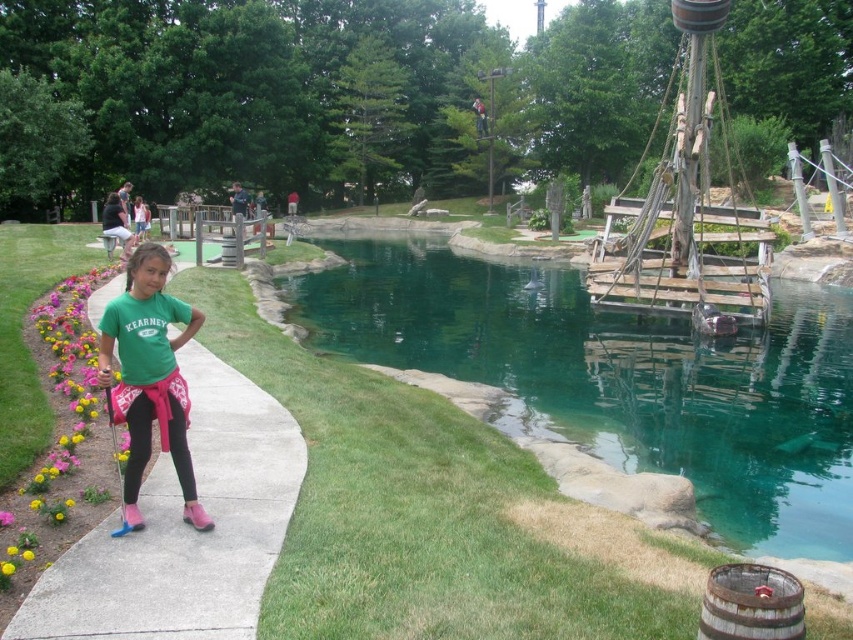
Based on the photo, is concrete sidewalk at center left shorter than green matte shirt at center?

No.

Is point (264, 396) in front of point (120, 348)?

That is False.

At what (x,y) coordinates should I click in order to perform the action: click on concrete sidewalk at center left. Please return your answer as a coordinate pair (x, y). The height and width of the screenshot is (640, 853). Looking at the image, I should click on (184, 529).

Looking at this image, does teal glassy water at center have a larger size compared to green matte shirt at center?

Indeed, teal glassy water at center has a larger size compared to green matte shirt at center.

Who is taller, teal glassy water at center or green matte shirt at center?

teal glassy water at center is taller.

At what (x,y) coordinates should I click in order to perform the action: click on teal glassy water at center. Please return your answer as a coordinate pair (x, y). Looking at the image, I should click on pos(619,378).

Which is below, teal glassy water at center or concrete sidewalk at center left?

Positioned lower is concrete sidewalk at center left.

Is teal glassy water at center bigger than concrete sidewalk at center left?

Yes.

Is point (724, 396) farther from camera compared to point (254, 564)?

Yes, point (724, 396) is behind point (254, 564).

Locate an element on the screen. This screenshot has width=853, height=640. teal glassy water at center is located at coordinates (619, 378).